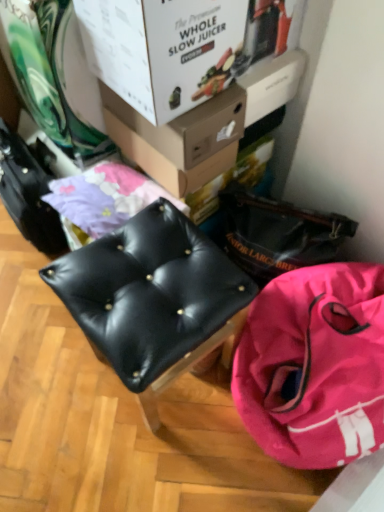
Question: In which direction should I rotate to look at white cardboard box at upper center, placed as the 1th box when sorted from front to back?

Choices:
 (A) left
 (B) right

Answer: (A)

Question: From the image's perspective, would you say matte cardboard box at upper center, acting as the second box starting from the front, is shown under white cardboard box at upper center, placed as the 1th box when sorted from front to back?

Choices:
 (A) yes
 (B) no

Answer: (A)

Question: Is there a large distance between matte cardboard box at upper center, marked as the 1th box in a back-to-front arrangement, and white cardboard box at upper center, which is the second box from back to front?

Choices:
 (A) no
 (B) yes

Answer: (A)

Question: Is matte cardboard box at upper center, acting as the second box starting from the front, smaller than white cardboard box at upper center, placed as the 1th box when sorted from front to back?

Choices:
 (A) no
 (B) yes

Answer: (B)

Question: Is matte cardboard box at upper center, marked as the 1th box in a back-to-front arrangement, at the right side of white cardboard box at upper center, which is the second box from back to front?

Choices:
 (A) yes
 (B) no

Answer: (A)

Question: Is matte cardboard box at upper center, acting as the second box starting from the front, outside of white cardboard box at upper center, placed as the 1th box when sorted from front to back?

Choices:
 (A) no
 (B) yes

Answer: (B)

Question: Does matte cardboard box at upper center, acting as the second box starting from the front, have a greater height compared to white cardboard box at upper center, which is the second box from back to front?

Choices:
 (A) yes
 (B) no

Answer: (B)

Question: From the image's perspective, would you say pink fabric bag at lower right is shown under black leather stool at center?

Choices:
 (A) no
 (B) yes

Answer: (B)

Question: Does pink fabric bag at lower right have a lesser height compared to black leather stool at center?

Choices:
 (A) yes
 (B) no

Answer: (A)

Question: From a real-world perspective, does pink fabric bag at lower right sit lower than black leather stool at center?

Choices:
 (A) yes
 (B) no

Answer: (A)

Question: Is pink fabric bag at lower right positioned beyond the bounds of black leather stool at center?

Choices:
 (A) yes
 (B) no

Answer: (A)

Question: Does pink fabric bag at lower right have a greater height compared to black leather stool at center?

Choices:
 (A) no
 (B) yes

Answer: (A)

Question: Is pink fabric bag at lower right at the right side of black leather stool at center?

Choices:
 (A) yes
 (B) no

Answer: (A)

Question: From a real-world perspective, is pink fabric bag at lower right on white cardboard box at upper center, placed as the 1th box when sorted from front to back?

Choices:
 (A) yes
 (B) no

Answer: (B)